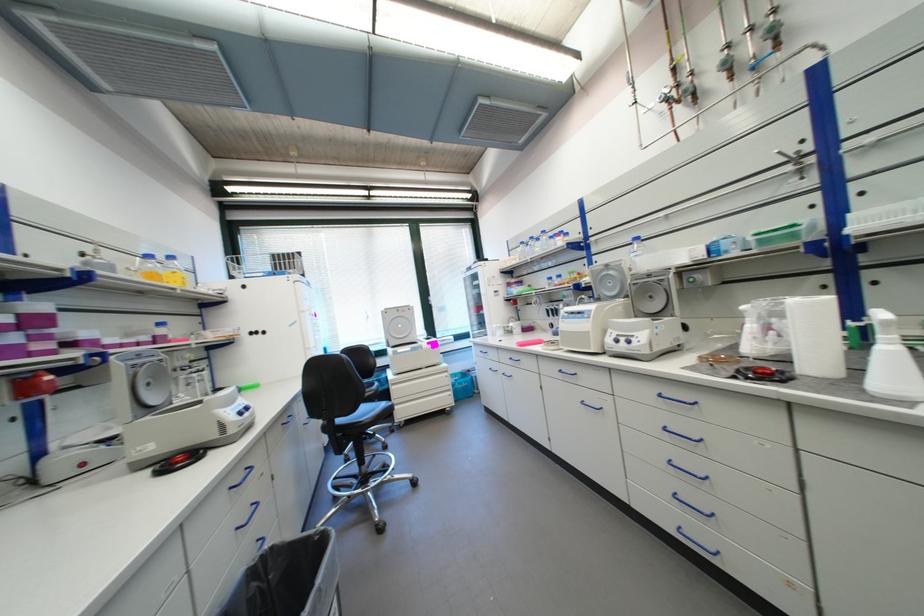
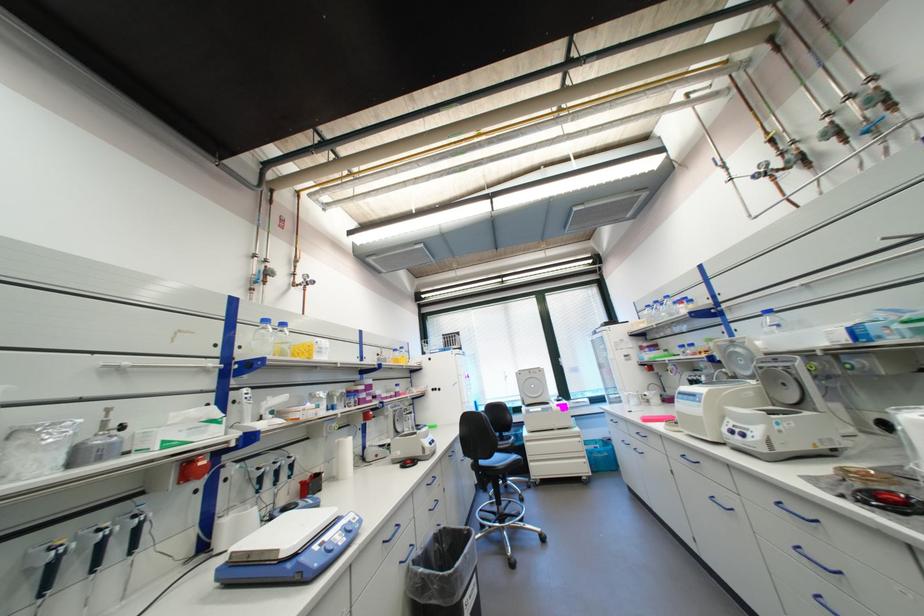
In the second image, find the point that corresponds to point 529,244 in the first image.

(655, 307)